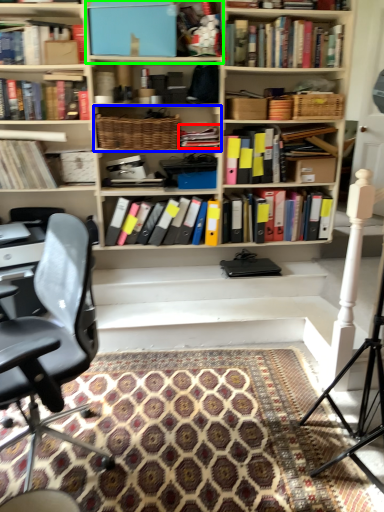
Question: Estimate the real-world distances between objects in this image. Which object is farther from book (highlighted by a red box), cabinet (highlighted by a blue box) or cabinet (highlighted by a green box)?

Choices:
 (A) cabinet
 (B) cabinet

Answer: (B)